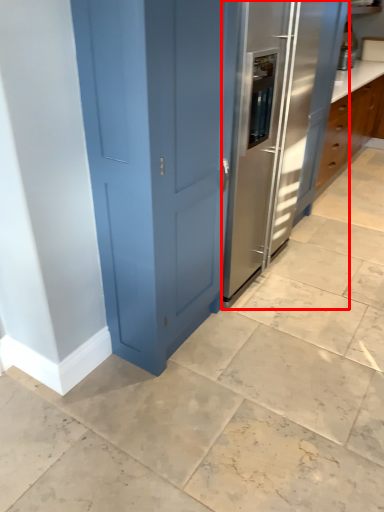
Question: From the image, what is the correct spatial relationship of fridge (annotated by the red box) in relation to appliance?

Choices:
 (A) left
 (B) right

Answer: (A)